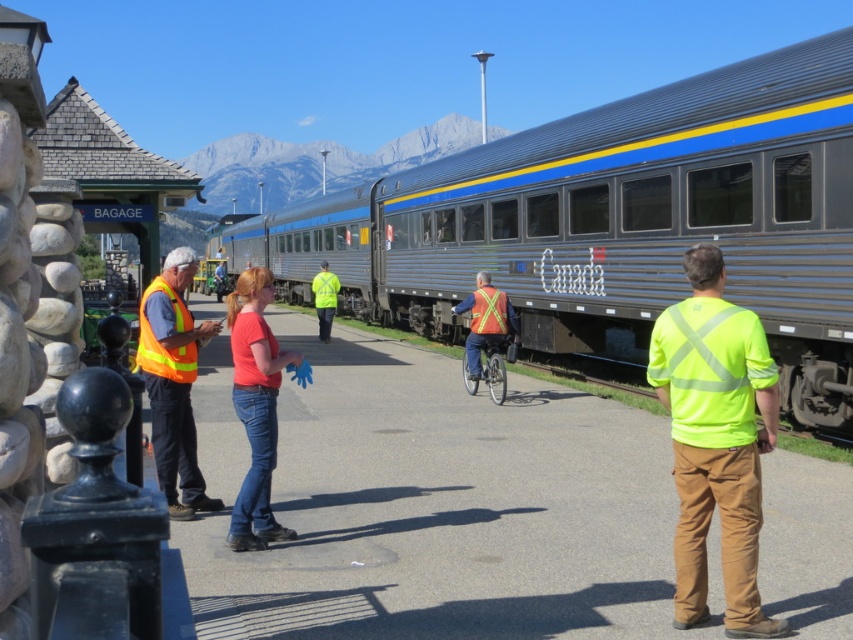
Question: Does hi-visibility reflective safety vest at center appear on the left side of high visibility yellow safety vest at center?

Choices:
 (A) no
 (B) yes

Answer: (A)

Question: Observing the image, what is the correct spatial positioning of metallic silver train at center in reference to orange reflective vest at center?

Choices:
 (A) left
 (B) right

Answer: (A)

Question: Can you confirm if neon yellow high visibility vest at center is positioned to the right of orange reflective vest at center?

Choices:
 (A) no
 (B) yes

Answer: (B)

Question: Which of these objects is positioned farthest from the hi-visibility orange safety vest at left?

Choices:
 (A) hi-visibility reflective safety vest at center
 (B) high visibility yellow safety vest at center
 (C) metallic silver train at center

Answer: (C)

Question: Among these points, which one is farthest from the camera?

Choices:
 (A) (663, 278)
 (B) (323, 296)
 (C) (184, 317)

Answer: (B)

Question: Which is nearer to the hi-visibility orange safety vest at left?

Choices:
 (A) metallic silver train at center
 (B) neon yellow high visibility vest at center
 (C) orange reflective vest at center

Answer: (C)